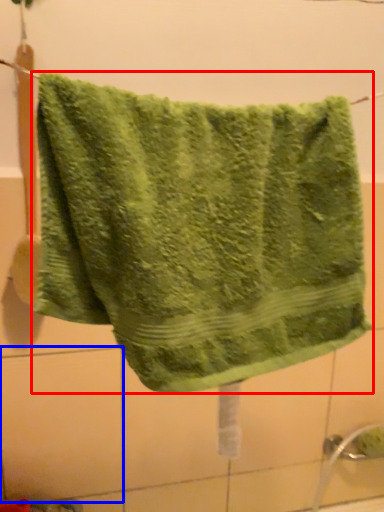
Question: Which object is closer to the camera taking this photo, towel (highlighted by a red box) or tile (highlighted by a blue box)?

Choices:
 (A) towel
 (B) tile

Answer: (A)